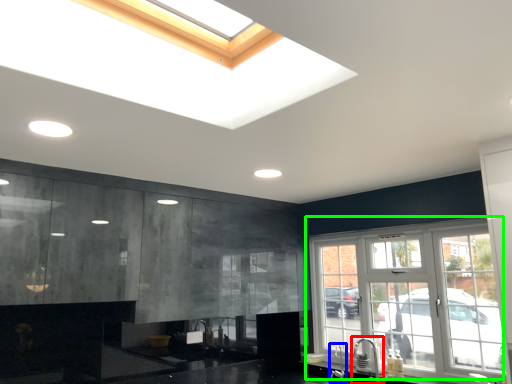
Question: Considering the real-world distances, which object is farthest from faucet (highlighted by a red box)? faucet (highlighted by a blue box) or window (highlighted by a green box)?

Choices:
 (A) faucet
 (B) window

Answer: (B)